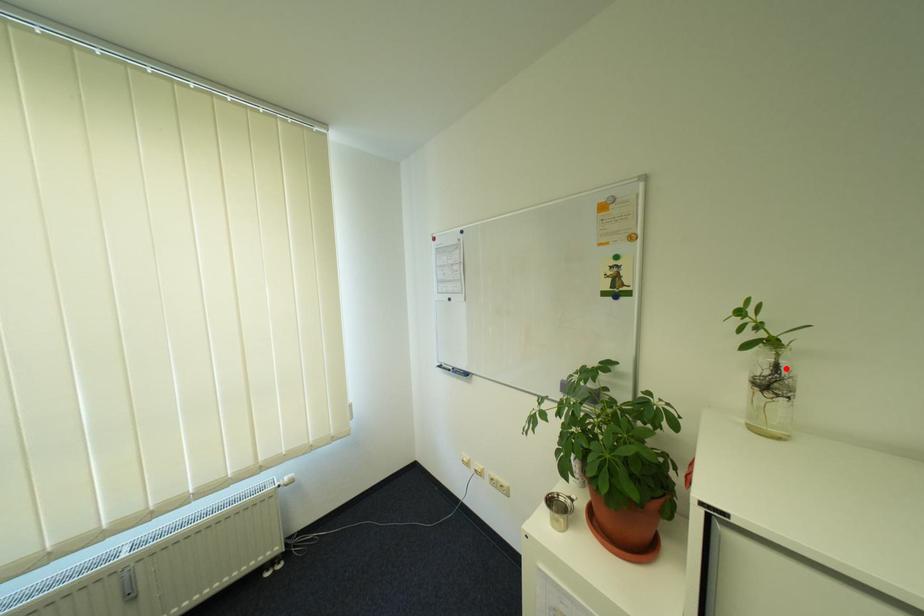
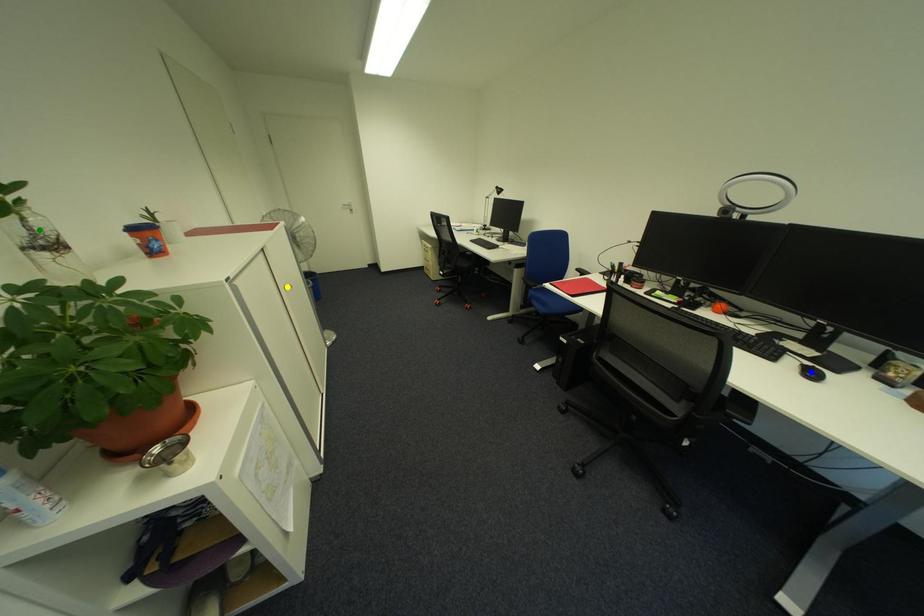
Question: I am providing you with two images of the same scene from different viewpoints. A red point is marked on the first image. You are given multiple points on the second image. Can you choose the point in image 2 that corresponds to the point in image 1?

Choices:
 (A) yellow point
 (B) blue point
 (C) green point

Answer: (C)